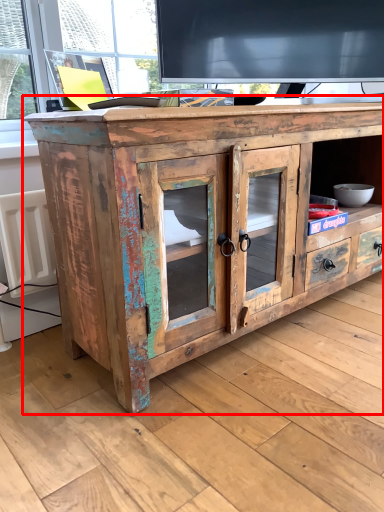
Question: Where is chest of drawers (annotated by the red box) located in relation to radiator in the image?

Choices:
 (A) right
 (B) left

Answer: (A)